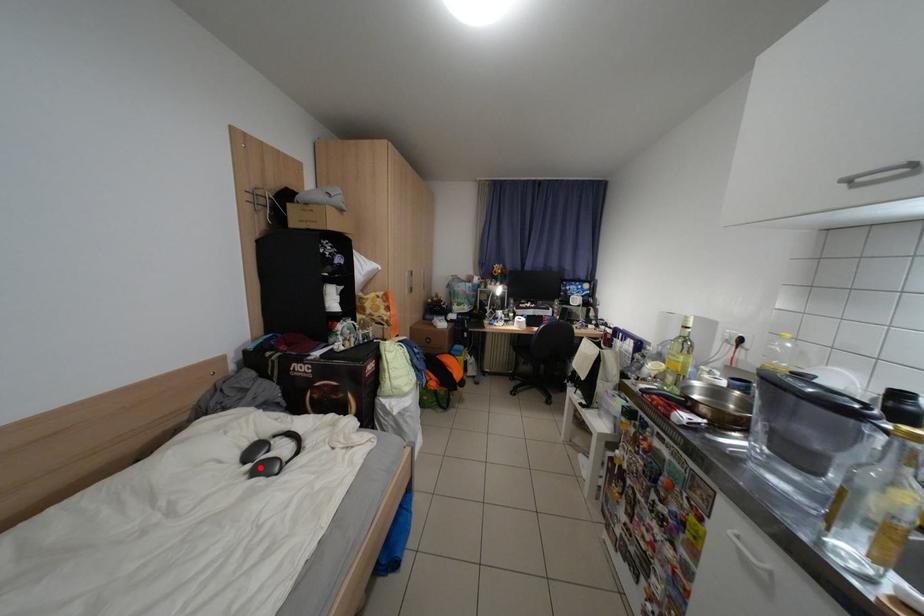
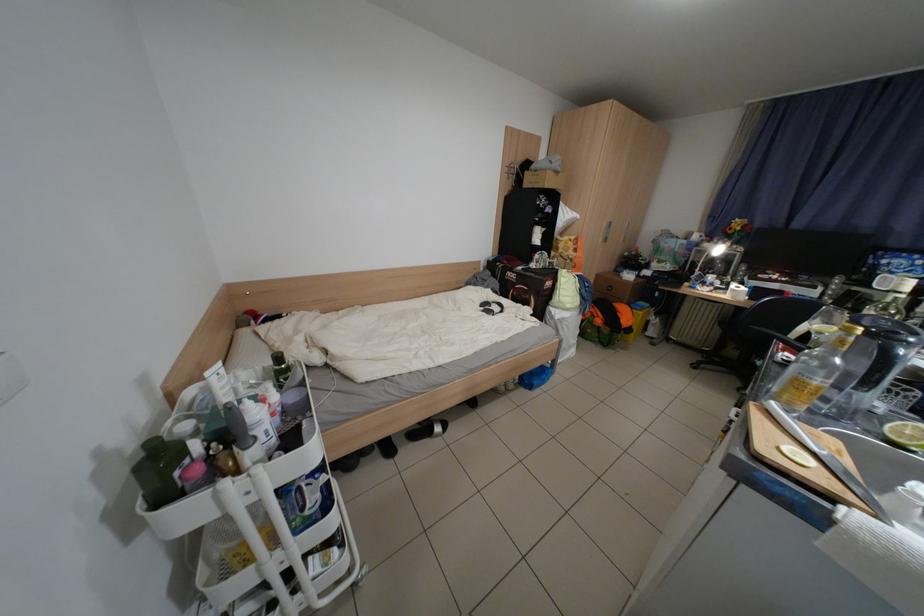
Where in the second image is the point corresponding to the highlighted location from the first image?

(493, 310)